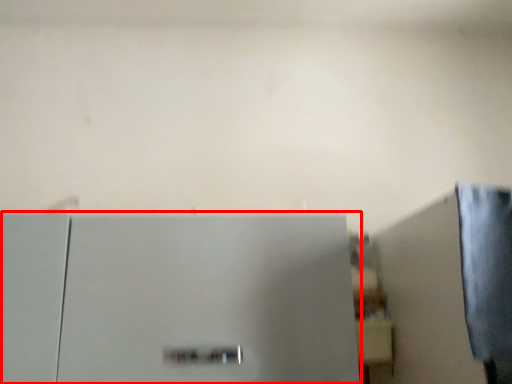
Question: Considering the relative positions of refrigerator (annotated by the red box) and shelf in the image provided, where is refrigerator (annotated by the red box) located with respect to the staircase?

Choices:
 (A) left
 (B) right

Answer: (A)